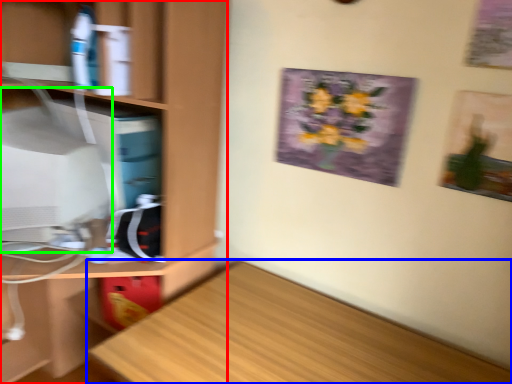
Question: Estimate the real-world distances between objects in this image. Which object is closer to cabinetry (highlighted by a red box), desk (highlighted by a blue box) or computer monitor (highlighted by a green box)?

Choices:
 (A) desk
 (B) computer monitor

Answer: (B)